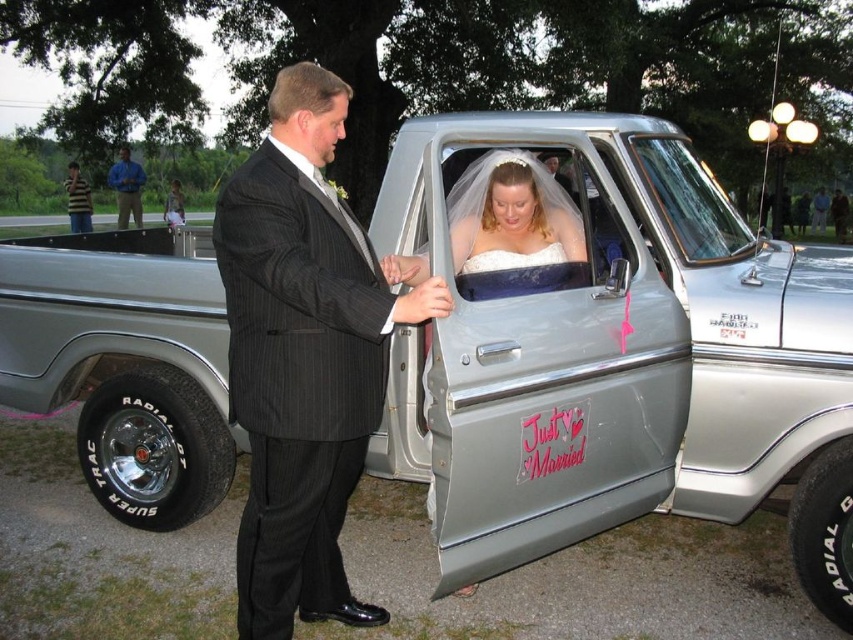
Does black pinstripe suit at center lie in front of blue shirt at left?

Yes, it is in front of blue shirt at left.

Who is lower down, black pinstripe suit at center or blue shirt at left?

black pinstripe suit at center

Locate an element on the screen. This screenshot has width=853, height=640. black pinstripe suit at center is located at coordinates (303, 356).

Locate an element on the screen. black pinstripe suit at center is located at coordinates (303, 356).

Between black pinstripe suit at center and striped shirt at left, which one is positioned higher?

striped shirt at left

I want to click on black pinstripe suit at center, so click(303, 356).

Between point (293, 237) and point (126, 150), which one is positioned in front?

Positioned in front is point (293, 237).

Locate an element on the screen. black pinstripe suit at center is located at coordinates (303, 356).

Which of these two, black pinstripe suit at center or white satin dress at center, stands taller?

Standing taller between the two is black pinstripe suit at center.

Is black pinstripe suit at center below white satin dress at center?

Yes.

What do you see at coordinates (303, 356) in the screenshot?
I see `black pinstripe suit at center` at bounding box center [303, 356].

You are a GUI agent. You are given a task and a screenshot of the screen. Output one action in this format:
    pyautogui.click(x=<x>, y=<y>)
    Task: Click on the black pinstripe suit at center
    
    Given the screenshot: What is the action you would take?
    pyautogui.click(x=303, y=356)